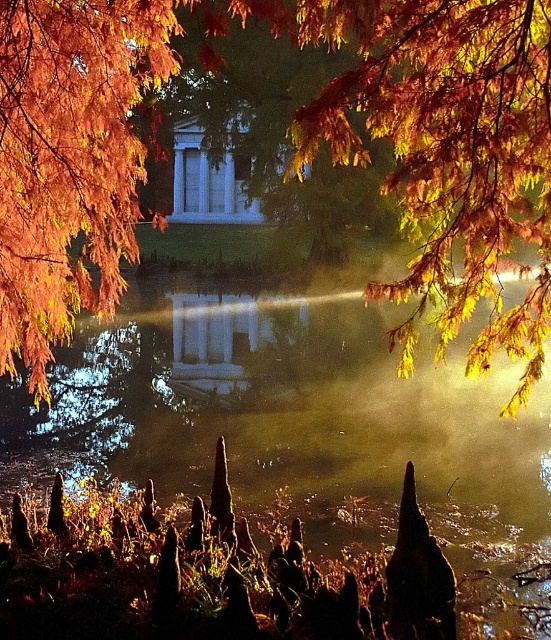
Which is more to the left, orange matte leaves at upper left or white marble gazebo at center?

white marble gazebo at center

The width and height of the screenshot is (551, 640). What are the coordinates of `orange matte leaves at upper left` in the screenshot? It's located at (71, 161).

Find the location of `orange matte leaves at upper left`. orange matte leaves at upper left is located at coordinates (71, 161).

Does orange leafy branch at upper left have a greater width compared to white marble gazebo at center?

Yes, orange leafy branch at upper left is wider than white marble gazebo at center.

Where is `orange leafy branch at upper left`? orange leafy branch at upper left is located at coordinates (293, 154).

Between orange leafy branch at upper left and orange matte leaves at upper left, which one is positioned lower?

orange matte leaves at upper left is below.

Is orange leafy branch at upper left to the left of orange matte leaves at upper left from the viewer's perspective?

Indeed, orange leafy branch at upper left is positioned on the left side of orange matte leaves at upper left.

Does point (379, 288) lie in front of point (121, 52)?

That is True.

Image resolution: width=551 pixels, height=640 pixels. In order to click on orange leafy branch at upper left in this screenshot , I will do `click(293, 154)`.